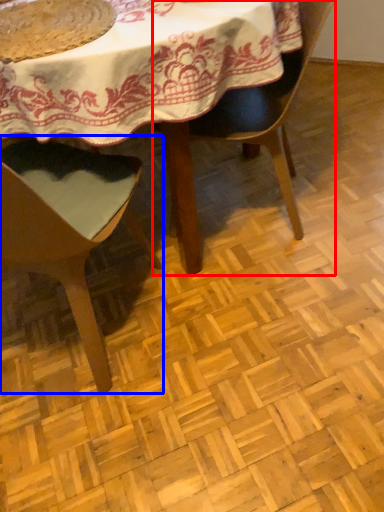
Question: Among these objects, which one is nearest to the camera, chair (highlighted by a red box) or chair (highlighted by a blue box)?

Choices:
 (A) chair
 (B) chair

Answer: (B)